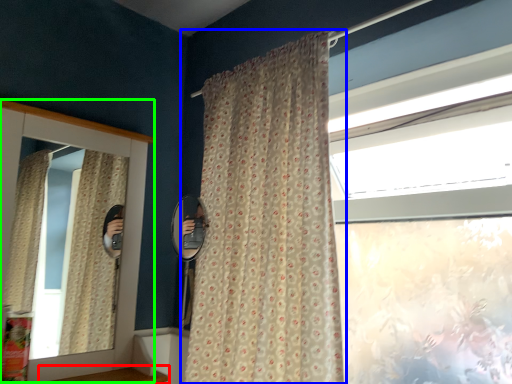
Question: Based on their relative distances, which object is farther from window sill (highlighted by a red box)? Choose from curtain (highlighted by a blue box) and medicine cabinet (highlighted by a green box).

Choices:
 (A) curtain
 (B) medicine cabinet

Answer: (A)